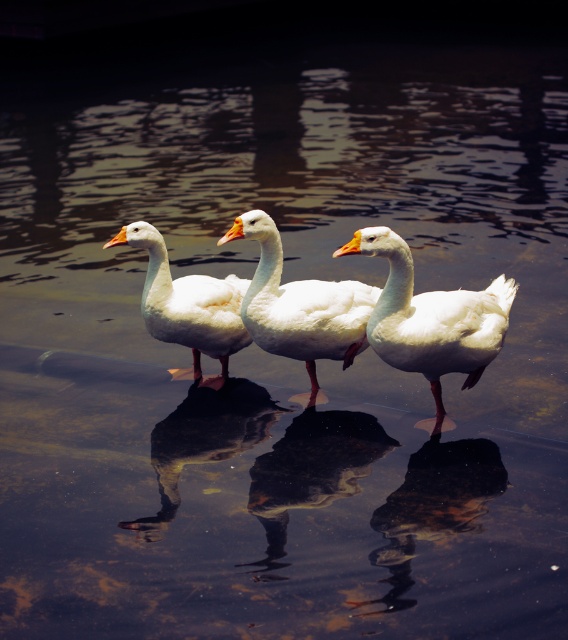
Question: Can you confirm if white matte duck at center is bigger than white matte goose at center?

Choices:
 (A) no
 (B) yes

Answer: (B)

Question: Is white glossy duck at center thinner than white matte duck at center?

Choices:
 (A) yes
 (B) no

Answer: (B)

Question: Which point is farther from the camera taking this photo?

Choices:
 (A) (266, 499)
 (B) (341, 300)
 (C) (394, 305)
 (D) (158, 294)

Answer: (D)

Question: Which object is farther from the camera taking this photo?

Choices:
 (A) white glossy swan at center
 (B) white matte duck at center
 (C) white matte goose at center

Answer: (C)

Question: Based on their relative distances, which object is nearer to the white matte duck at center?

Choices:
 (A) white glossy duck at center
 (B) white glossy swan at center
 (C) white matte goose at center

Answer: (B)

Question: Does white matte duck at center appear over white matte goose at center?

Choices:
 (A) no
 (B) yes

Answer: (A)